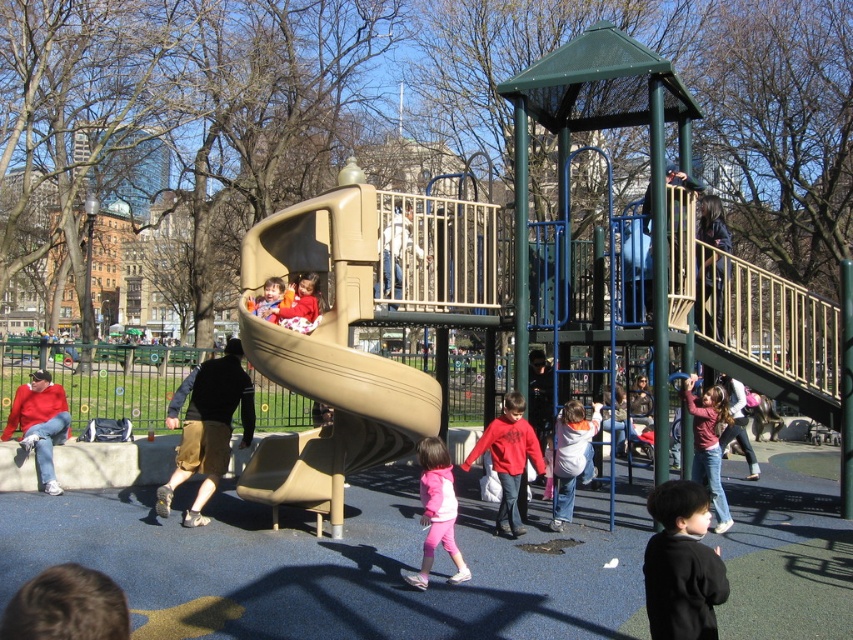
Question: Which point is farther to the camera?

Choices:
 (A) 299,332
 (B) 733,392
 (C) 258,243

Answer: (B)

Question: Which object is positioned farthest from the red cotton sweater at left?

Choices:
 (A) white cotton hoodie at center
 (B) red matte sweatshirt at center
 (C) black matte jacket at lower right
 (D) pink fleece jacket at center

Answer: (C)

Question: Does brown hair at lower left appear over light brown wooden slide at center?

Choices:
 (A) yes
 (B) no

Answer: (B)

Question: Does brown hair at lower left appear on the left side of pink fleece jacket at center?

Choices:
 (A) yes
 (B) no

Answer: (A)

Question: Which of the following is the farthest from the observer?

Choices:
 (A) (567, 448)
 (B) (680, 600)

Answer: (A)

Question: Where is brown hair at lower left located in relation to dark brown hair at upper right in the image?

Choices:
 (A) right
 (B) left

Answer: (B)